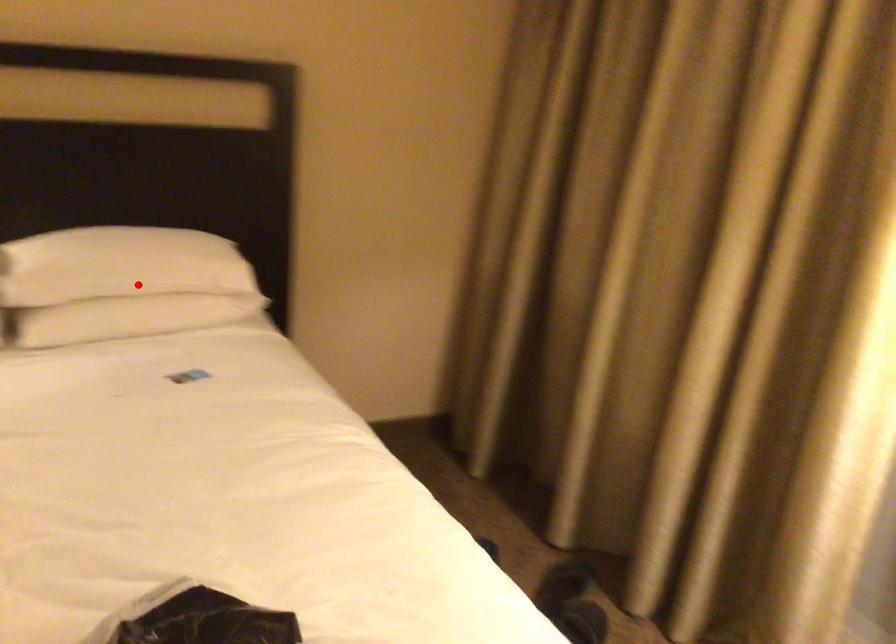
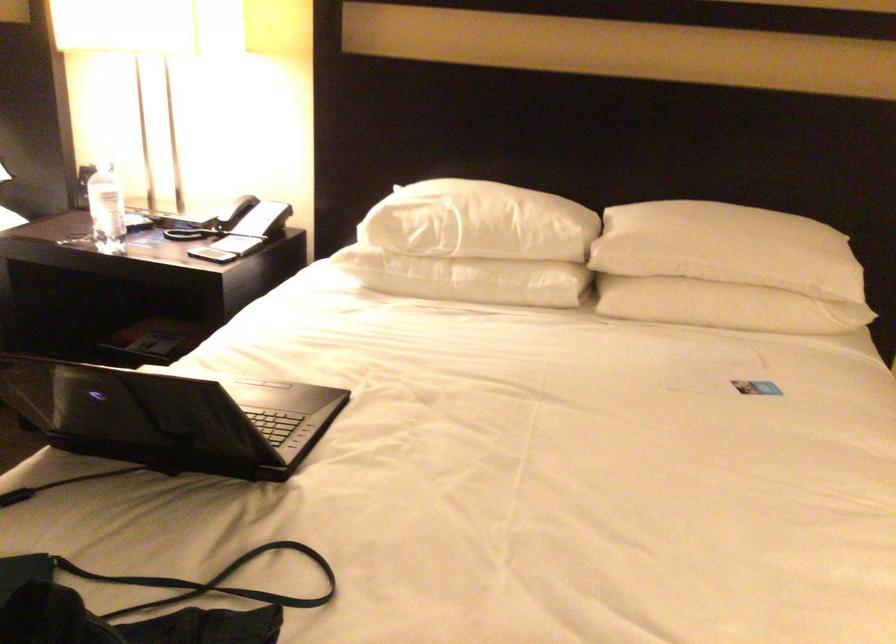
Question: I am providing you with two images of the same scene from different viewpoints. A red point is marked on the first image. Is the red point's position out of view in image 2?

Choices:
 (A) Yes
 (B) No

Answer: (B)